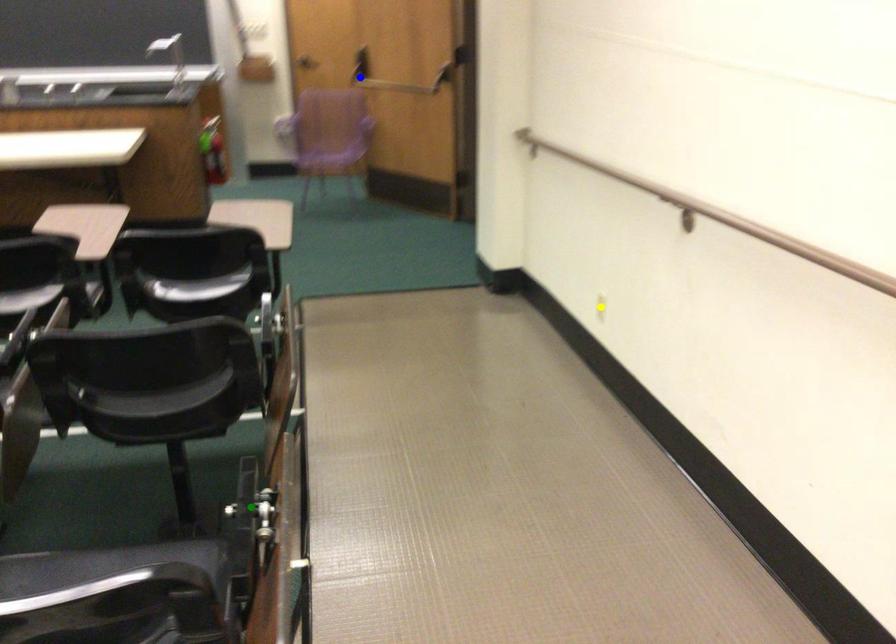
Order these from nearest to farthest:
green point | blue point | yellow point

1. green point
2. yellow point
3. blue point